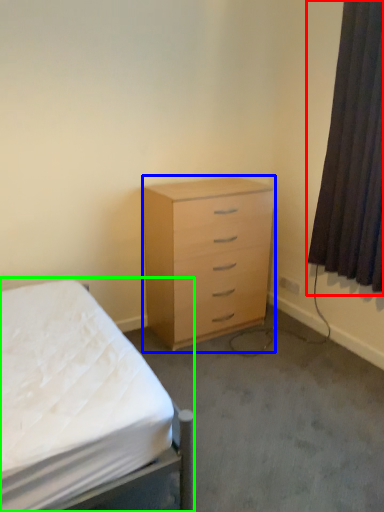
Question: Based on their relative distances, which object is nearer to curtain (highlighted by a red box)? Choose from chest of drawers (highlighted by a blue box) and bed (highlighted by a green box).

Choices:
 (A) chest of drawers
 (B) bed

Answer: (A)